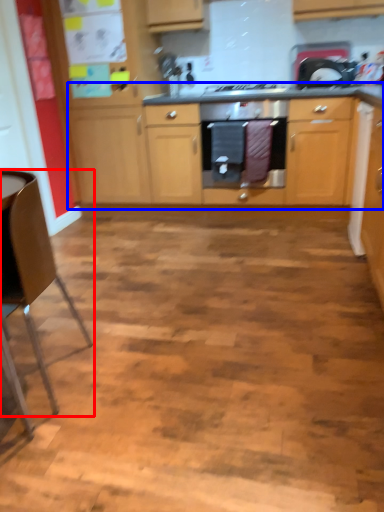
Question: Which point is further to the camera, chair (highlighted by a red box) or cabinetry (highlighted by a blue box)?

Choices:
 (A) chair
 (B) cabinetry

Answer: (B)